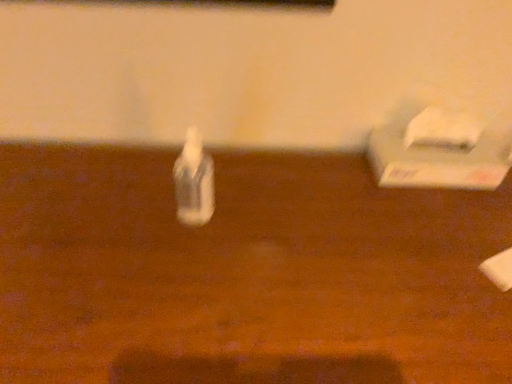
Find the location of a particular element. The width and height of the screenshot is (512, 384). blank space situated above wooden table at center (from a real-world perspective) is located at coordinates (230, 235).